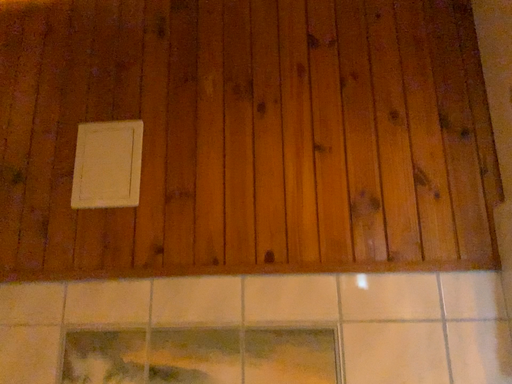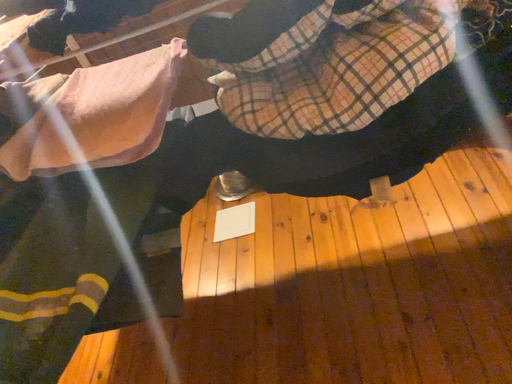
Question: How did the camera likely rotate when shooting the video?

Choices:
 (A) rotated downward
 (B) rotated upward

Answer: (B)